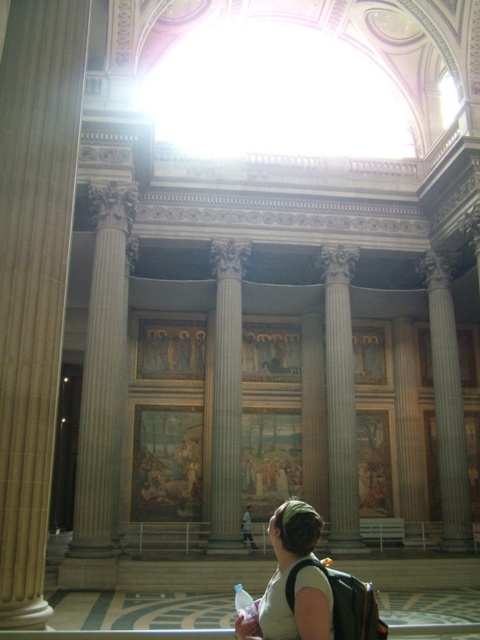
You are an architect examining the interior of a grand classical building. You notice the smooth beige column at left and the satin gold column at center. Which column is located higher up in the building?

The smooth beige column at left is positioned over the satin gold column at center, meaning it is higher up in the building.

You are an architect assessing the symmetry of the building. Which column is positioned further to the left, the smooth beige column at left or the satin gold column at center?

The smooth beige column at left is positioned further to the left compared to the satin gold column at center.